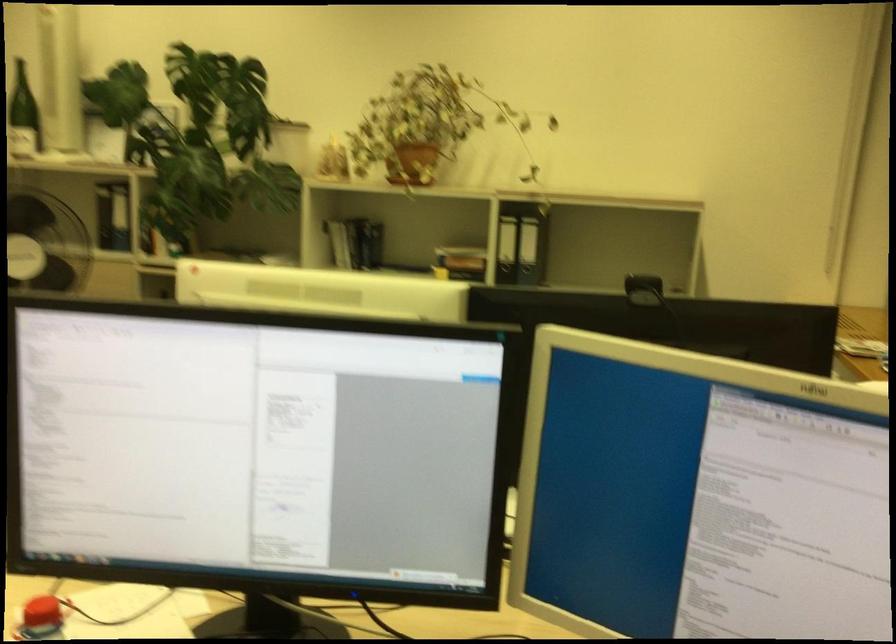
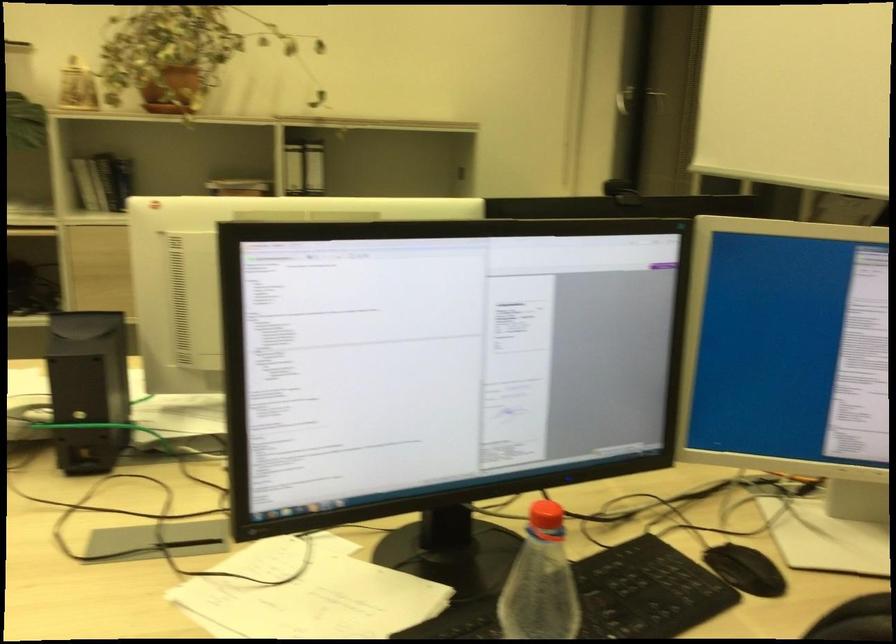
Question: The camera is either moving clockwise (left) or counter-clockwise (right) around the object. The first image is from the beginning of the video and the second image is from the end. Is the camera moving left or right when shooting the video?

Choices:
 (A) Left
 (B) Right

Answer: (A)